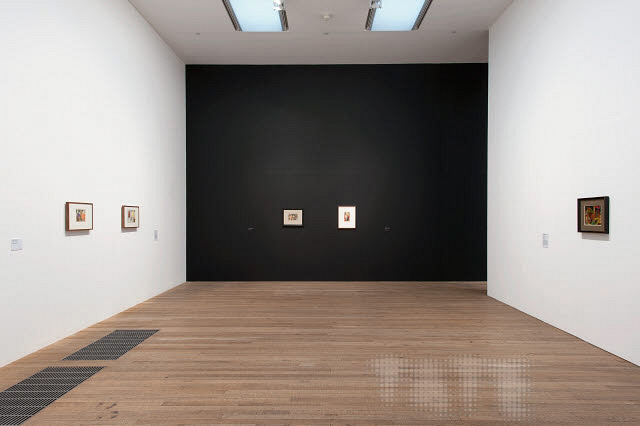
Identify the location of 1 vent on the left. This screenshot has height=426, width=640. (27, 402).